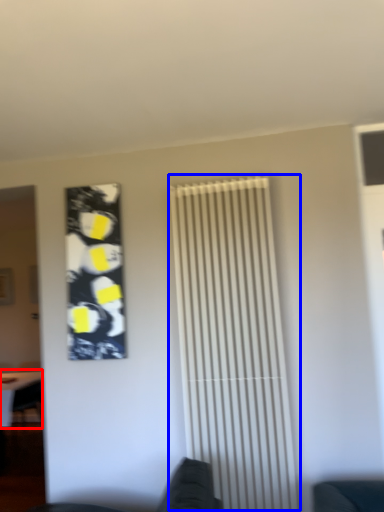
Question: Which object appears closest to the camera in this image, table (highlighted by a red box) or shutter (highlighted by a blue box)?

Choices:
 (A) table
 (B) shutter

Answer: (B)